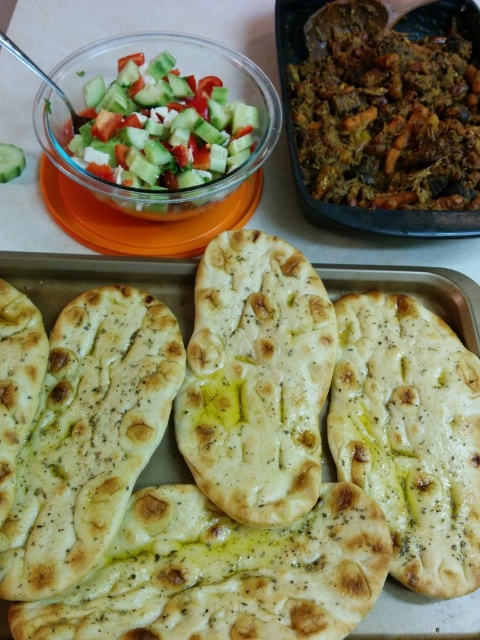
Question: Considering the real-world distances, which object is farthest from the olive oil brushed flatbread at center?

Choices:
 (A) fresh green salad at upper left
 (B) green cucumber at upper left

Answer: (B)

Question: Is olive oil brushed flatbread at center in front of brown textured stew at upper right?

Choices:
 (A) no
 (B) yes

Answer: (B)

Question: Is olive oil brushed flatbread at center wider than green cucumber at upper left?

Choices:
 (A) yes
 (B) no

Answer: (A)

Question: Does fresh green salad at upper left have a lesser width compared to white soft flatbread at center?

Choices:
 (A) yes
 (B) no

Answer: (A)

Question: Which point is farther to the camera?

Choices:
 (A) green cucumber at upper left
 (B) brown textured stew at upper right
 (C) white soft flatbread at center

Answer: (A)

Question: Which object appears closest to the camera in this image?

Choices:
 (A) white soft flatbread at center
 (B) green cucumber at upper left
 (C) brown textured stew at upper right
 (D) olive oil brushed flatbread at center

Answer: (A)